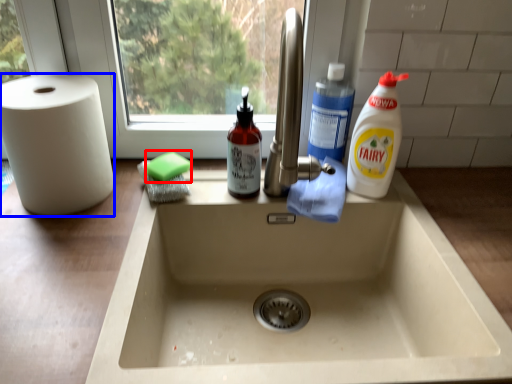
Question: Which object appears farthest to the camera in this image, soap (highlighted by a red box) or paper towel (highlighted by a blue box)?

Choices:
 (A) soap
 (B) paper towel

Answer: (A)